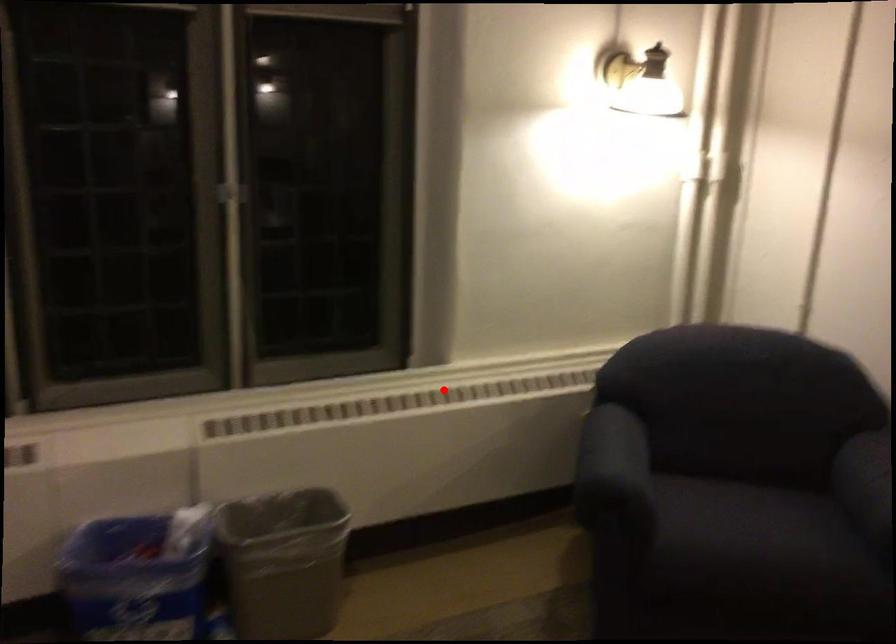
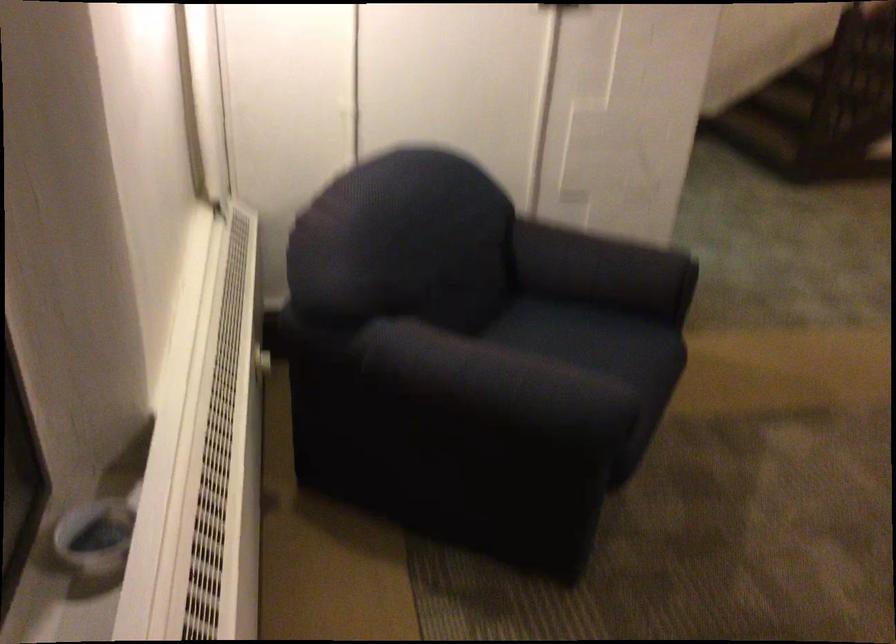
Question: I am providing you with two images of the same scene from different viewpoints. A red point is marked on the first image. At the location where the point appears in image 1, is it still visible in image 2?

Choices:
 (A) Yes
 (B) No

Answer: (A)